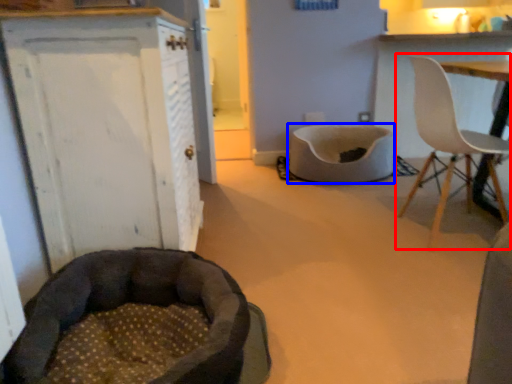
Question: Which point is closer to the camera, chair (highlighted by a red box) or cat bed (highlighted by a blue box)?

Choices:
 (A) chair
 (B) cat bed

Answer: (A)